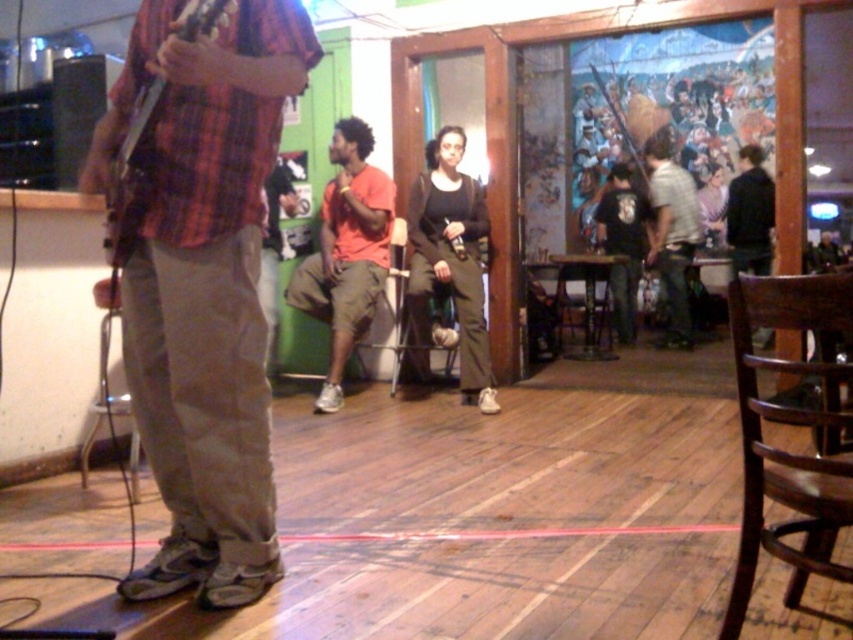
Question: Where is orange cotton shirt at center located in relation to light gray shirt at center in the image?

Choices:
 (A) left
 (B) right

Answer: (A)

Question: Estimate the real-world distances between objects in this image. Which object is closer to the wooden acoustic guitar at left?

Choices:
 (A) light gray shirt at center
 (B) black matte jacket at right
 (C) matte black shirt at center

Answer: (C)

Question: Can you confirm if plaid fabric shirt at left is positioned to the left of orange cotton shirt at center?

Choices:
 (A) yes
 (B) no

Answer: (A)

Question: Among these points, which one is farthest from the camera?

Choices:
 (A) (648, 154)
 (B) (107, 202)
 (C) (376, 209)

Answer: (A)

Question: Can you confirm if orange cotton shirt at center is positioned to the right of black matte jacket at right?

Choices:
 (A) no
 (B) yes

Answer: (A)

Question: Considering the real-world distances, which object is closest to the wooden acoustic guitar at left?

Choices:
 (A) matte black shirt at center
 (B) plaid fabric shirt at left

Answer: (B)